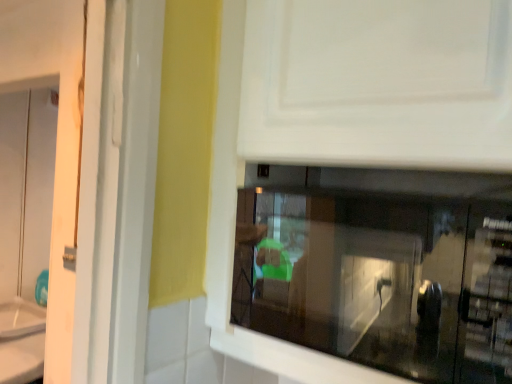
Identify the location of transparent glass microwave at center. The height and width of the screenshot is (384, 512). (384, 269).

What is the approximate height of transparent glass microwave at center?

11.18 inches.

The height and width of the screenshot is (384, 512). Describe the element at coordinates (384, 269) in the screenshot. I see `transparent glass microwave at center` at that location.

What is the approximate width of transparent glass microwave at center?

It is 13.32 inches.

Measure the distance between transparent glass microwave at center and camera.

transparent glass microwave at center is 17.83 inches from camera.

The width and height of the screenshot is (512, 384). In order to click on transparent glass microwave at center in this screenshot , I will do `click(384, 269)`.